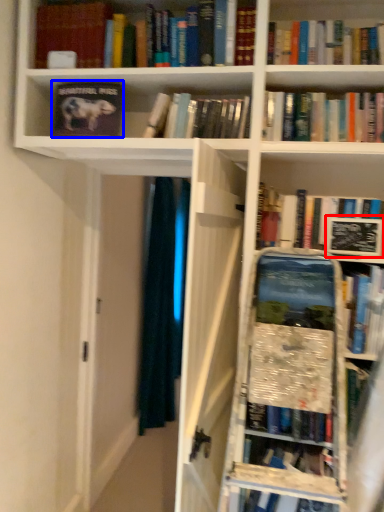
Question: Which object is closer to the camera taking this photo, paperback book (highlighted by a red box) or book (highlighted by a blue box)?

Choices:
 (A) paperback book
 (B) book

Answer: (A)